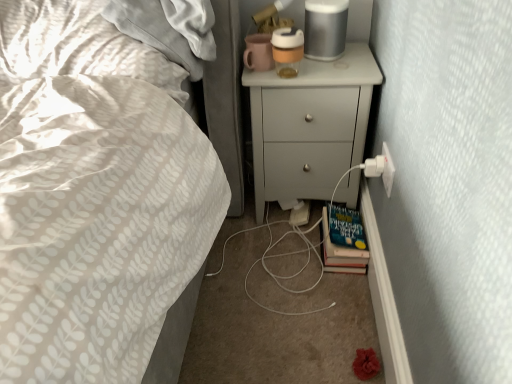
At what (x,y) coordinates should I click in order to perform the action: click on hardcover book at lower right. Please return your answer as a coordinate pair (x, y). The image size is (512, 384). Looking at the image, I should click on (341, 253).

Are hardcover book at lower right and white matte chest of drawers at upper right located far from each other?

No, hardcover book at lower right is not far away from white matte chest of drawers at upper right.

Is point (365, 250) positioned after point (315, 190)?

No.

From the image's perspective, which is above, hardcover book at lower right or white matte chest of drawers at upper right?

white matte chest of drawers at upper right.

I want to click on chest of drawers on the left of hardcover book at lower right, so click(309, 125).

Is hardcover book at lower right inside the boundaries of white plastic electric outlet at lower right, or outside?

hardcover book at lower right is not enclosed by white plastic electric outlet at lower right.

You are a GUI agent. You are given a task and a screenshot of the screen. Output one action in this format:
    pyautogui.click(x=<x>, y=<y>)
    Task: Click on the electric outlet on the right of hardcover book at lower right
    
    Given the screenshot: What is the action you would take?
    pyautogui.click(x=387, y=169)

Considering the sizes of hardcover book at lower right and white plastic electric outlet at lower right in the image, is hardcover book at lower right wider or thinner than white plastic electric outlet at lower right?

In the image, hardcover book at lower right appears to be wider than white plastic electric outlet at lower right.

Would you consider hardcover book at lower right to be distant from white plastic electric outlet at lower right?

No, hardcover book at lower right is not far away from white plastic electric outlet at lower right.

Is white plastic electric outlet at lower right bigger than hardcover book at lower right?

Incorrect, white plastic electric outlet at lower right is not larger than hardcover book at lower right.

Which is farther from the camera, (387, 177) or (360, 256)?

The point (360, 256) is farther.

From the image's perspective, is white plastic electric outlet at lower right below hardcover book at lower right?

Actually, white plastic electric outlet at lower right appears above hardcover book at lower right in the image.

Which is behind, white plastic electric outlet at lower right or hardcover book at lower right?

hardcover book at lower right is more distant.

Is white matte chest of drawers at upper right facing away from white plastic electric outlet at lower right?

No.

Can you confirm if white matte chest of drawers at upper right is positioned to the right of white plastic electric outlet at lower right?

No, white matte chest of drawers at upper right is not to the right of white plastic electric outlet at lower right.

Looking at their sizes, would you say white matte chest of drawers at upper right is wider or thinner than white plastic electric outlet at lower right?

Considering their sizes, white matte chest of drawers at upper right looks broader than white plastic electric outlet at lower right.

Is the position of white matte chest of drawers at upper right less distant than that of white plastic electric outlet at lower right?

That is False.

Is white matte chest of drawers at upper right turned away from hardcover book at lower right?

No.

How different are the orientations of white matte chest of drawers at upper right and hardcover book at lower right in degrees?

There is a 4.44-degree angle between the facing directions of white matte chest of drawers at upper right and hardcover book at lower right.

Would you say white matte chest of drawers at upper right is to the left or to the right of hardcover book at lower right in the picture?

white matte chest of drawers at upper right is to the left of hardcover book at lower right.

Is white plastic electric outlet at lower right placed right next to white matte chest of drawers at upper right?

There is a gap between white plastic electric outlet at lower right and white matte chest of drawers at upper right.

Consider the image. Between white plastic electric outlet at lower right and white matte chest of drawers at upper right, which one has smaller width?

white plastic electric outlet at lower right is thinner.

Could you tell me if white plastic electric outlet at lower right is facing white matte chest of drawers at upper right?

No, white plastic electric outlet at lower right is not turned towards white matte chest of drawers at upper right.

Is point (384, 163) in front of point (354, 69)?

Yes, point (384, 163) is in front of point (354, 69).

The width and height of the screenshot is (512, 384). Identify the location of chest of drawers on the left of hardcover book at lower right. (309, 125).

This screenshot has height=384, width=512. I want to click on electric outlet above the hardcover book at lower right (from the image's perspective), so click(x=387, y=169).

When comparing their distances from white matte chest of drawers at upper right, does hardcover book at lower right or white plastic electric outlet at lower right seem further?

white plastic electric outlet at lower right lies further to white matte chest of drawers at upper right than the other object.

Looking at the image, which one is located closer to white plastic electric outlet at lower right, white matte chest of drawers at upper right or hardcover book at lower right?

hardcover book at lower right.

From the image, which object appears to be farther from hardcover book at lower right, white matte chest of drawers at upper right or white plastic electric outlet at lower right?

Among the two, white matte chest of drawers at upper right is located further to hardcover book at lower right.

Looking at the image, which one is located closer to white plastic electric outlet at lower right, hardcover book at lower right or white matte chest of drawers at upper right?

The object closer to white plastic electric outlet at lower right is hardcover book at lower right.

Based on their spatial positions, is white plastic electric outlet at lower right or hardcover book at lower right further from white matte chest of drawers at upper right?

Among the two, white plastic electric outlet at lower right is located further to white matte chest of drawers at upper right.

From the image, which object appears to be farther from hardcover book at lower right, white plastic electric outlet at lower right or white matte chest of drawers at upper right?

white matte chest of drawers at upper right.

Where is `electric outlet that lies between white matte chest of drawers at upper right and hardcover book at lower right from top to bottom`? Image resolution: width=512 pixels, height=384 pixels. electric outlet that lies between white matte chest of drawers at upper right and hardcover book at lower right from top to bottom is located at coordinates (387, 169).